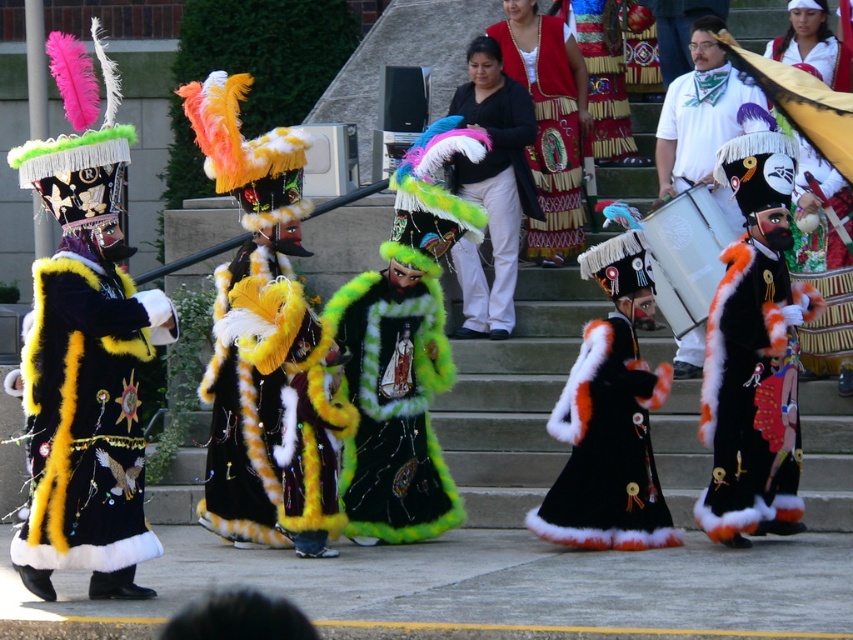
Question: Among these points, which one is farthest from the camera?

Choices:
 (A) (273, 316)
 (B) (805, 307)
 (C) (605, 525)
 (D) (463, 264)

Answer: (D)

Question: Does fluffy yellow-green coat at center have a greater width compared to white cotton drum at right?

Choices:
 (A) yes
 (B) no

Answer: (A)

Question: Which point is closer to the camera?

Choices:
 (A) fluffy yellow-green coat at center
 (B) black fur robe at left
 (C) embroidered velvet dress at center
 (D) green fuzzy coat at center

Answer: (B)

Question: Which object is closer to the camera taking this photo?

Choices:
 (A) black velvet coat with fur trim at center
 (B) white cotton drum at right
 (C) black fur robe at left
 (D) fluffy multicolored headdress at center

Answer: (C)

Question: Can you confirm if black fur robe at left is bigger than green fuzzy coat at center?

Choices:
 (A) no
 (B) yes

Answer: (A)

Question: Is white cotton drum at right behind embroidered velvet dress at center?

Choices:
 (A) yes
 (B) no

Answer: (B)